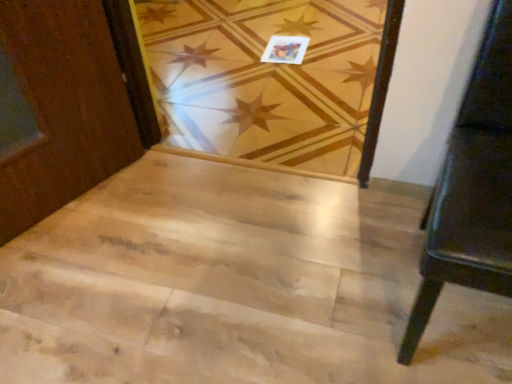
Locate an element on the screen. This screenshot has height=384, width=512. vacant area that lies in front of matte paper postcard at upper center is located at coordinates (290, 72).